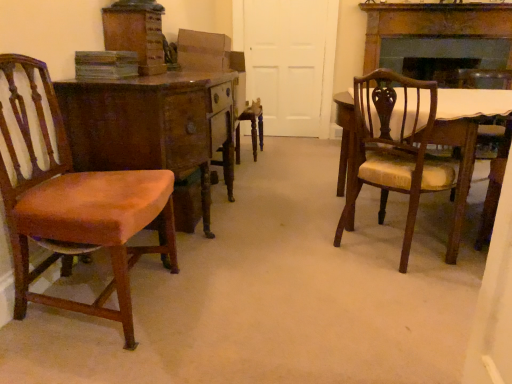
This screenshot has width=512, height=384. Find the location of `free point to the right of matte brown chair at right, positioned as the first chair in right-to-left order`. free point to the right of matte brown chair at right, positioned as the first chair in right-to-left order is located at coordinates (455, 263).